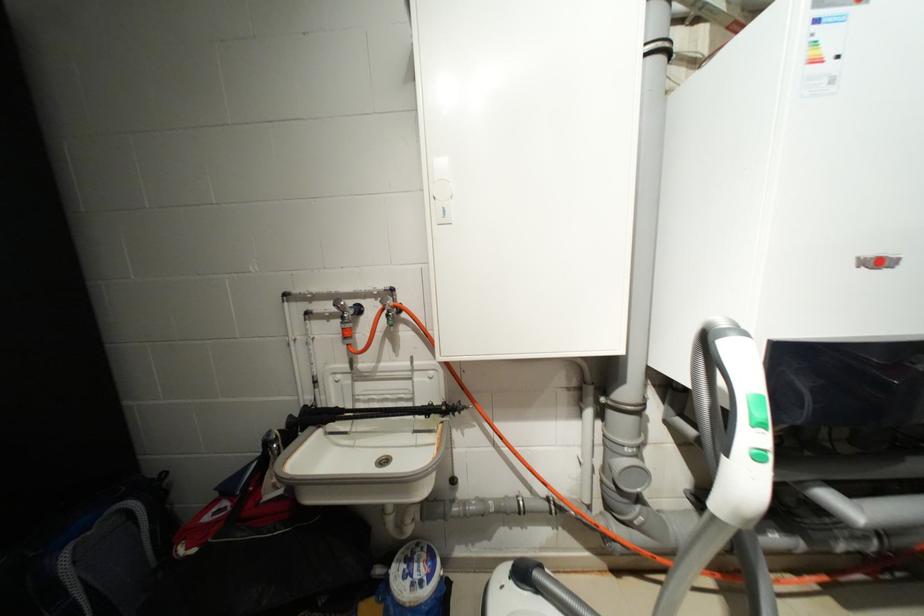
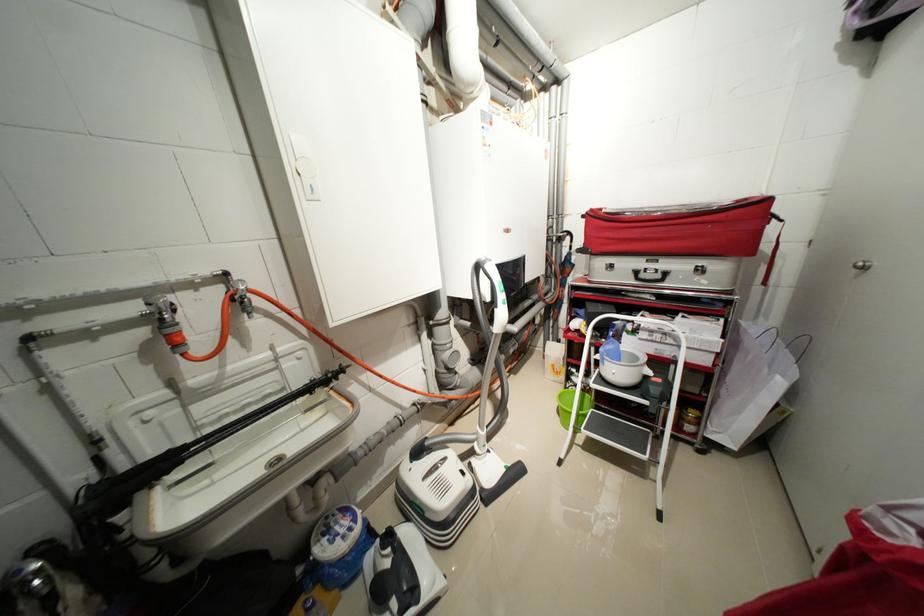
The point at (348, 323) is marked in the first image. Where is the corresponding point in the second image?

(167, 329)